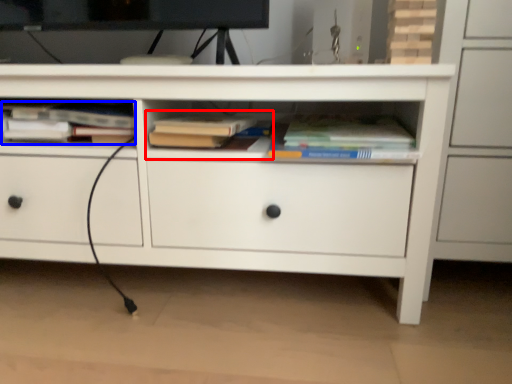
Question: Which point is closer to the camera, book (highlighted by a red box) or book (highlighted by a blue box)?

Choices:
 (A) book
 (B) book

Answer: (A)